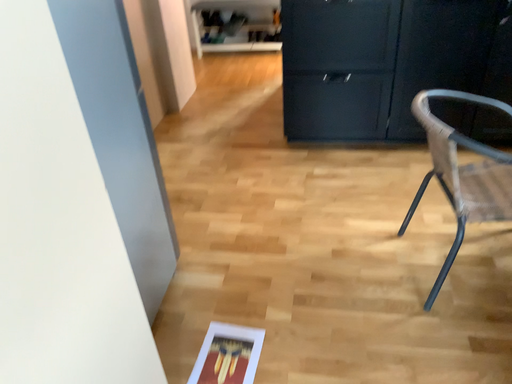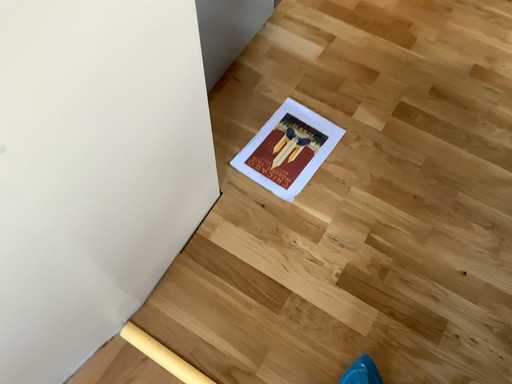
Question: Which way did the camera rotate in the video?

Choices:
 (A) rotated upward
 (B) rotated downward

Answer: (B)